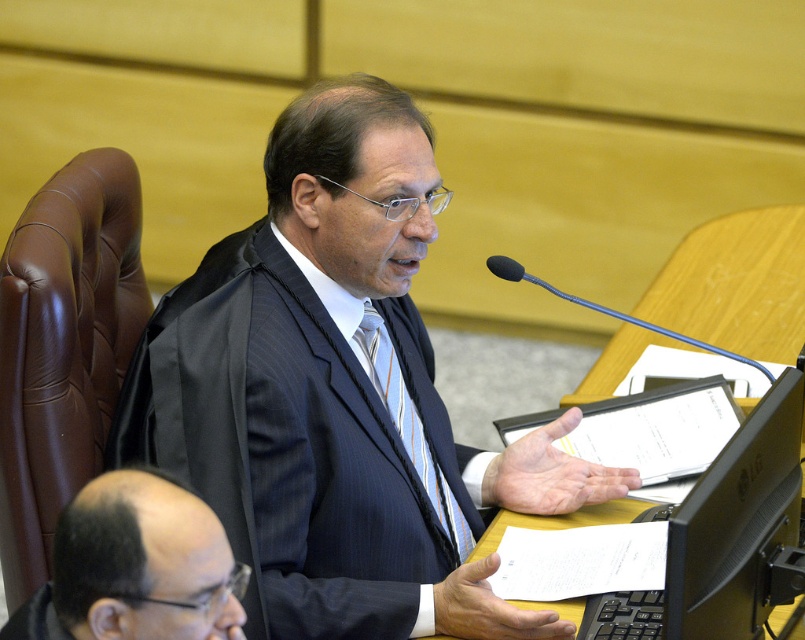
Which of these two, bald head at lower left or black plastic microphone at upper center, stands shorter?

bald head at lower left

Can you confirm if bald head at lower left is thinner than black plastic microphone at upper center?

Indeed, bald head at lower left has a lesser width compared to black plastic microphone at upper center.

Is point (96, 557) closer to camera compared to point (576, 298)?

Yes, point (96, 557) is in front of point (576, 298).

Locate an element on the screen. bald head at lower left is located at coordinates (133, 566).

Which is below, dark blue pinstripe suit at center or black plastic microphone at upper center?

dark blue pinstripe suit at center is below.

In the scene shown: Is dark blue pinstripe suit at center shorter than black plastic microphone at upper center?

Incorrect, dark blue pinstripe suit at center's height does not fall short of black plastic microphone at upper center's.

Where is `dark blue pinstripe suit at center`? dark blue pinstripe suit at center is located at coordinates (283, 445).

Describe the element at coordinates (724, 538) in the screenshot. I see `black plastic monitor at center` at that location.

Who is higher up, black plastic monitor at center or bald head at lower left?

bald head at lower left

What do you see at coordinates (724, 538) in the screenshot?
I see `black plastic monitor at center` at bounding box center [724, 538].

Locate an element on the screen. black plastic monitor at center is located at coordinates (724, 538).